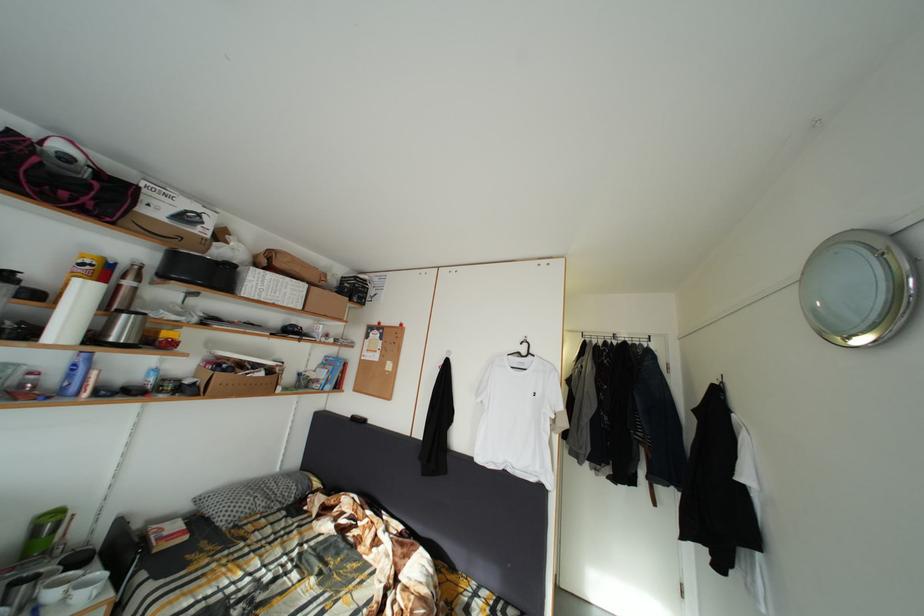
I want to click on black clothes hanger, so click(x=526, y=346).